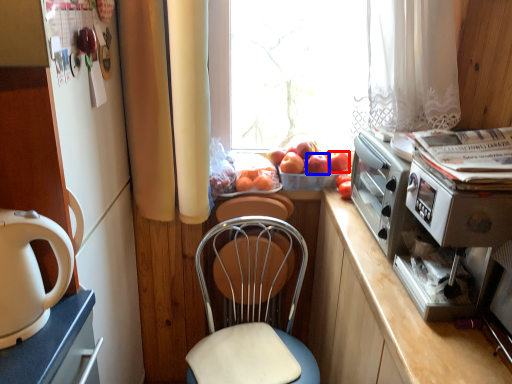
Question: Which object appears closest to the camera in this image, apple (highlighted by a red box) or apple (highlighted by a blue box)?

Choices:
 (A) apple
 (B) apple

Answer: (B)